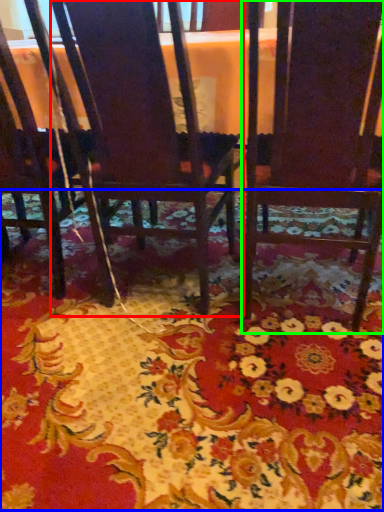
Question: Which object is the closest to the chair (highlighted by a red box)? Choose among these: mat (highlighted by a blue box) or chair (highlighted by a green box).

Choices:
 (A) mat
 (B) chair

Answer: (B)